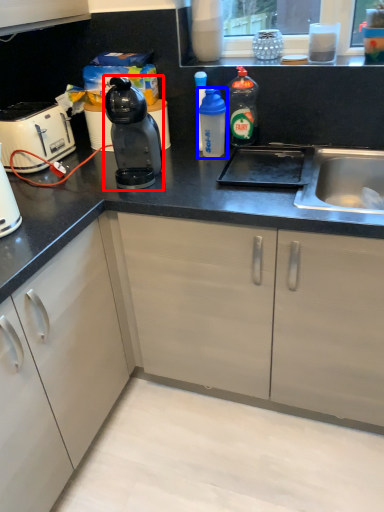
Question: Among these objects, which one is farthest to the camera, kitchen appliance (highlighted by a red box) or bottle (highlighted by a blue box)?

Choices:
 (A) kitchen appliance
 (B) bottle

Answer: (B)